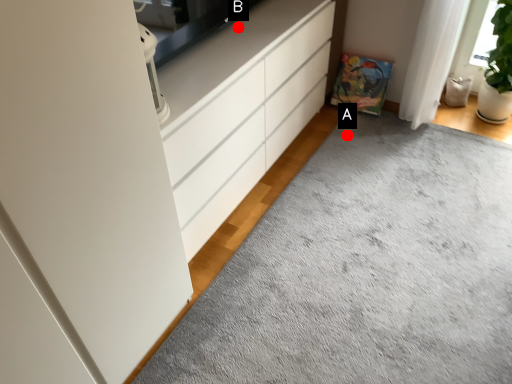
Question: Two points are circled on the image, labeled by A and B beside each circle. Which point appears farthest from the camera in this image?

Choices:
 (A) A is further
 (B) B is further

Answer: (A)